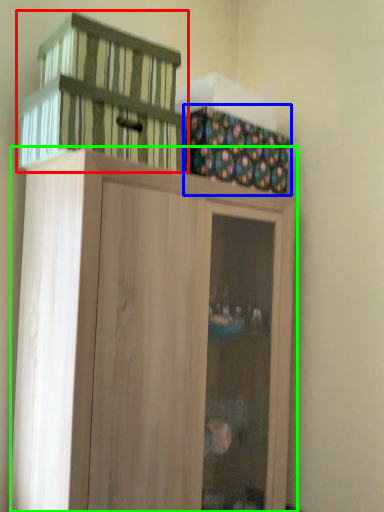
Question: Which is farther away from basket (highlighted by a red box)? cabinetry (highlighted by a blue box) or cupboard (highlighted by a green box)?

Choices:
 (A) cabinetry
 (B) cupboard

Answer: (B)